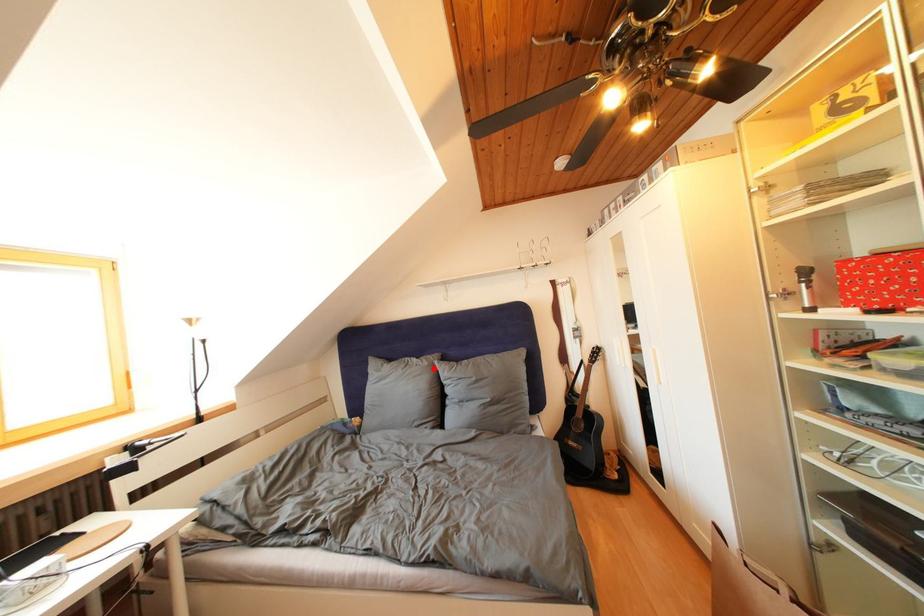
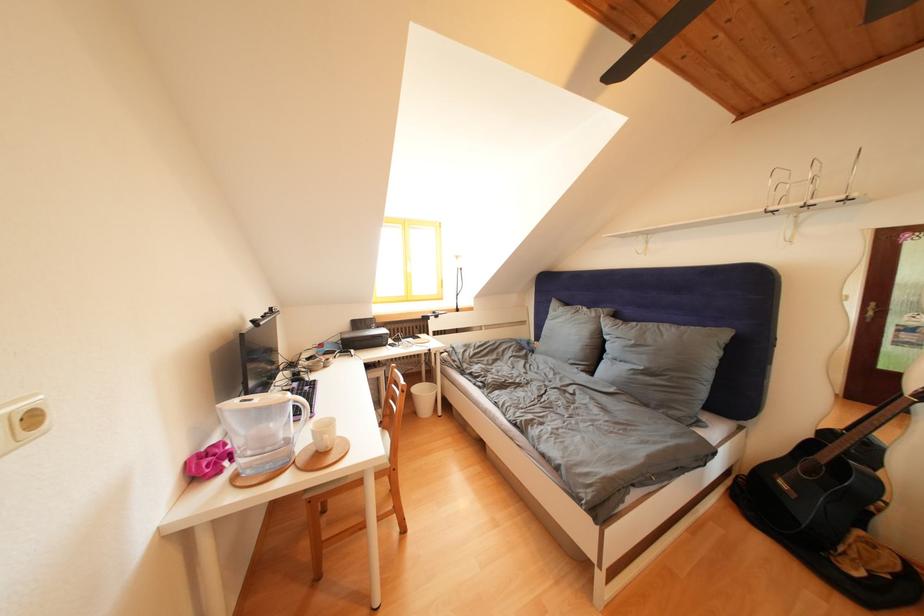
Find the pixel in the second image that matches the highlighted location in the first image.

(602, 320)